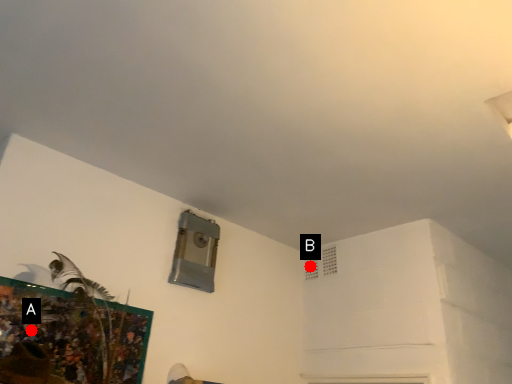
Question: Two points are circled on the image, labeled by A and B beside each circle. Which point is closer to the camera taking this photo?

Choices:
 (A) A is closer
 (B) B is closer

Answer: (A)